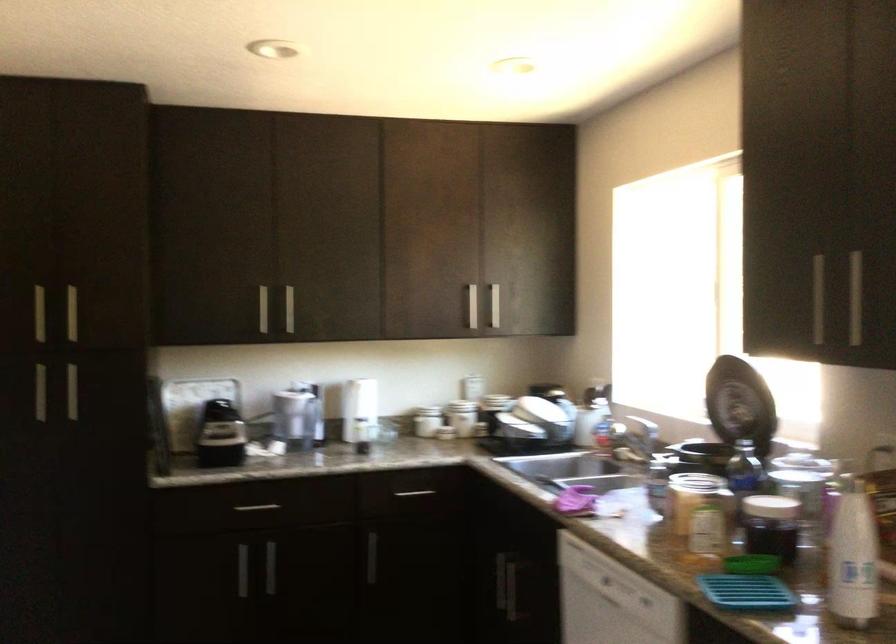
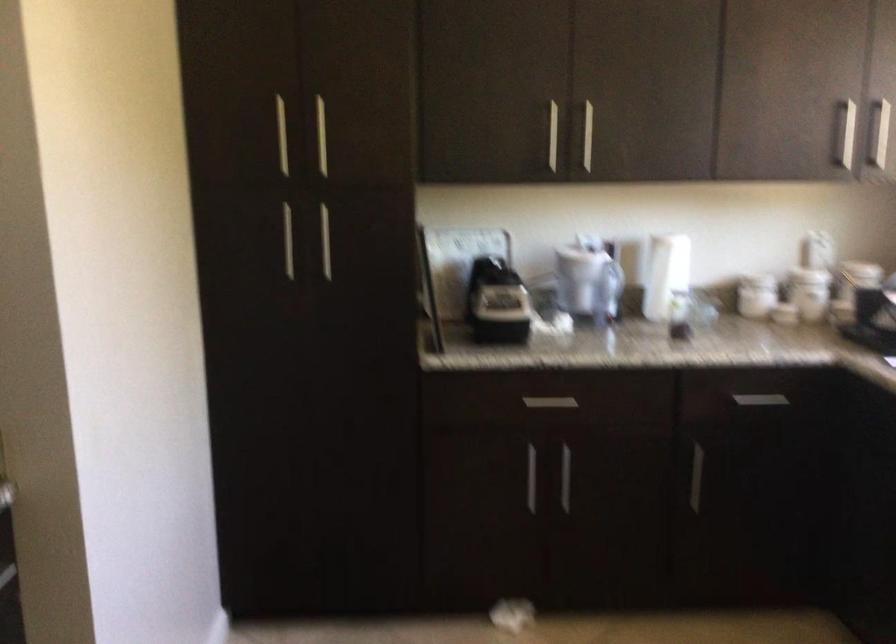
The point at (418, 421) is marked in the first image. Where is the corresponding point in the second image?

(755, 295)